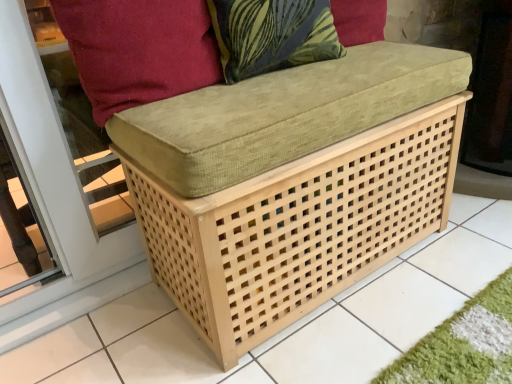
Question: Do you think velvety green pillow at upper center is within suede-like red cushion at upper left, or outside of it?

Choices:
 (A) outside
 (B) inside

Answer: (A)

Question: Visually, is velvety green pillow at upper center positioned to the left or to the right of suede-like red cushion at upper left?

Choices:
 (A) left
 (B) right

Answer: (B)

Question: In terms of size, does velvety green pillow at upper center appear bigger or smaller than suede-like red cushion at upper left?

Choices:
 (A) small
 (B) big

Answer: (A)

Question: Is suede-like red cushion at upper left bigger or smaller than velvety green pillow at upper center?

Choices:
 (A) big
 (B) small

Answer: (A)

Question: From a real-world perspective, is suede-like red cushion at upper left physically located above or below velvety green pillow at upper center?

Choices:
 (A) above
 (B) below

Answer: (B)

Question: From the image's perspective, is suede-like red cushion at upper left positioned above or below velvety green pillow at upper center?

Choices:
 (A) below
 (B) above

Answer: (A)

Question: Is suede-like red cushion at upper left inside the boundaries of velvety green pillow at upper center, or outside?

Choices:
 (A) outside
 (B) inside

Answer: (A)